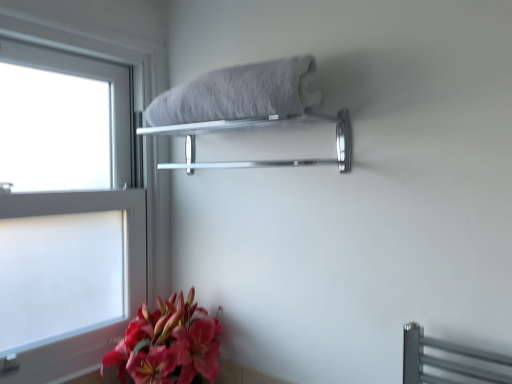
Question: From a real-world perspective, relative to silver metallic towel rack at upper center, is gray fluffy bath towel at upper center vertically above or below?

Choices:
 (A) below
 (B) above

Answer: (B)

Question: From the image's perspective, is gray fluffy bath towel at upper center located above or below silver metallic towel rack at upper center?

Choices:
 (A) above
 (B) below

Answer: (A)

Question: Which of these objects is positioned farthest from the gray fluffy bath towel at upper center?

Choices:
 (A) matte pink lily at lower left
 (B) silver metallic towel rack at upper center
 (C) clear glass window at left

Answer: (A)

Question: Estimate the real-world distances between objects in this image. Which object is farther from the clear glass window at left?

Choices:
 (A) silver metallic towel rack at upper center
 (B) gray fluffy bath towel at upper center
 (C) matte pink lily at lower left

Answer: (B)